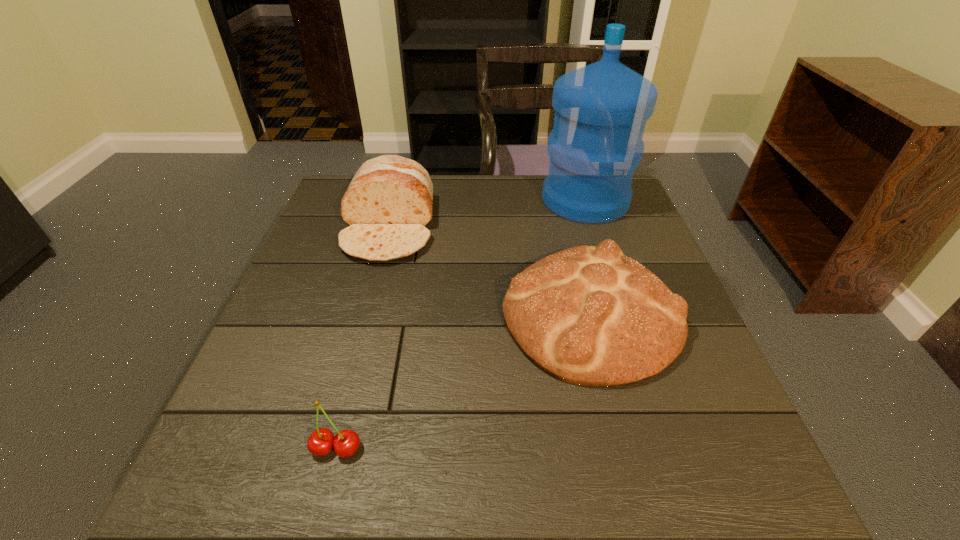
Where is `bread at the far edge`? bread at the far edge is located at coordinates (388, 203).

At what (x,y) coordinates should I click in order to perform the action: click on object positioned at the left edge. Please return your answer as a coordinate pair (x, y). Looking at the image, I should click on (388, 203).

Where is `water jug that is at the right edge`? water jug that is at the right edge is located at coordinates (601, 110).

Where is `bread present at the right edge`? The image size is (960, 540). bread present at the right edge is located at coordinates (588, 315).

You are a GUI agent. You are given a task and a screenshot of the screen. Output one action in this format:
    pyautogui.click(x=<x>, y=<y>)
    Task: Click on the object that is at the far left corner
    
    Given the screenshot: What is the action you would take?
    (388, 203)

Find the location of a particular element. Image resolution: width=960 pixels, height=540 pixels. object present at the far right corner is located at coordinates (601, 110).

In the image, there is a desktop. Where is `vacant space at the far edge`? The image size is (960, 540). vacant space at the far edge is located at coordinates (541, 190).

In the image, there is a desktop. Identify the location of free region at the near edge. The image size is (960, 540). (421, 496).

In the image, there is a desktop. Identify the location of vacant space at the left edge. click(x=300, y=460).

The height and width of the screenshot is (540, 960). I want to click on vacant space at the right edge of the desktop, so click(x=687, y=460).